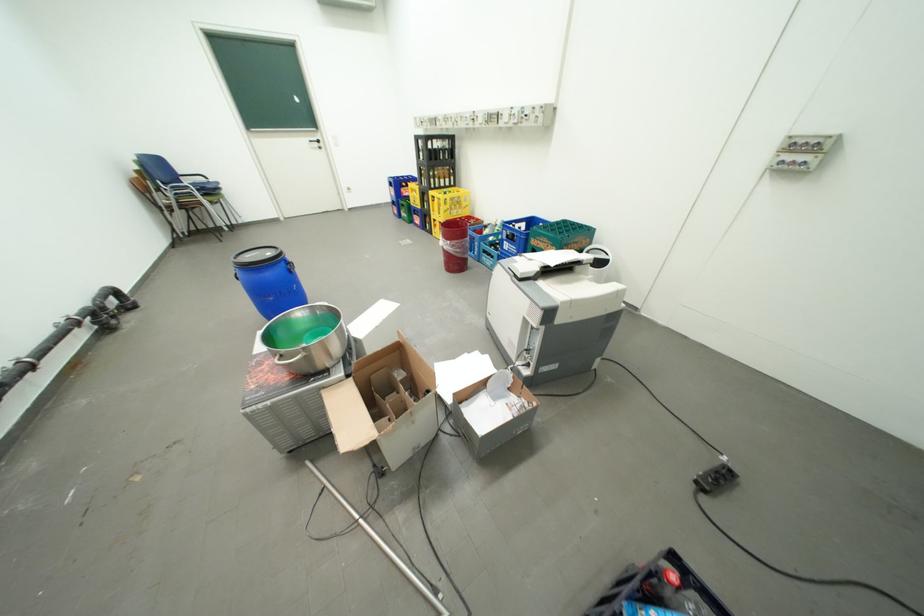
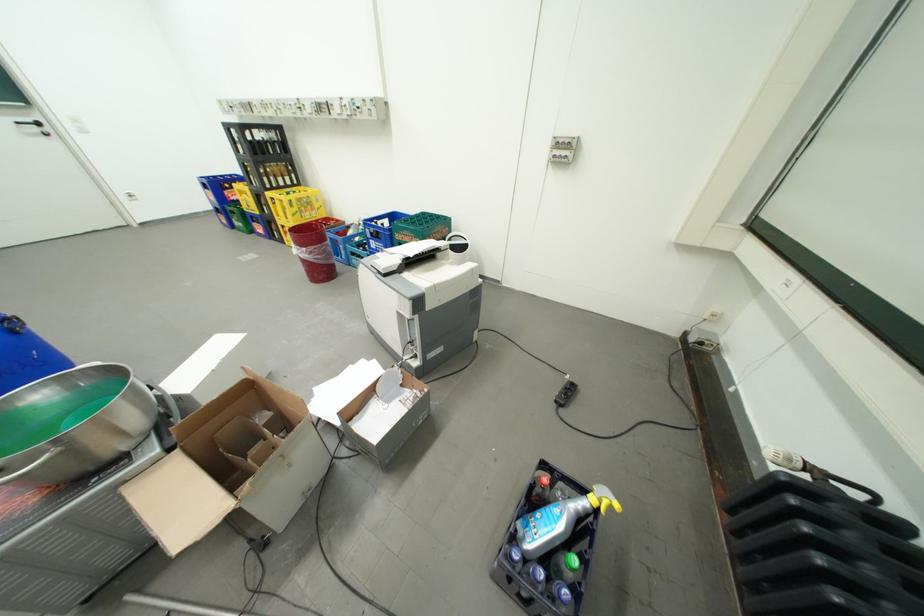
In the second image, find the point that corresponds to pixel 356 191 in the first image.

(134, 199)